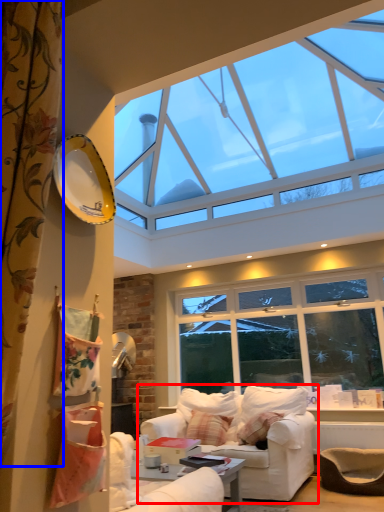
Question: Which object appears closest to the camera in this image, studio couch (highlighted by a red box) or curtain (highlighted by a blue box)?

Choices:
 (A) studio couch
 (B) curtain

Answer: (B)